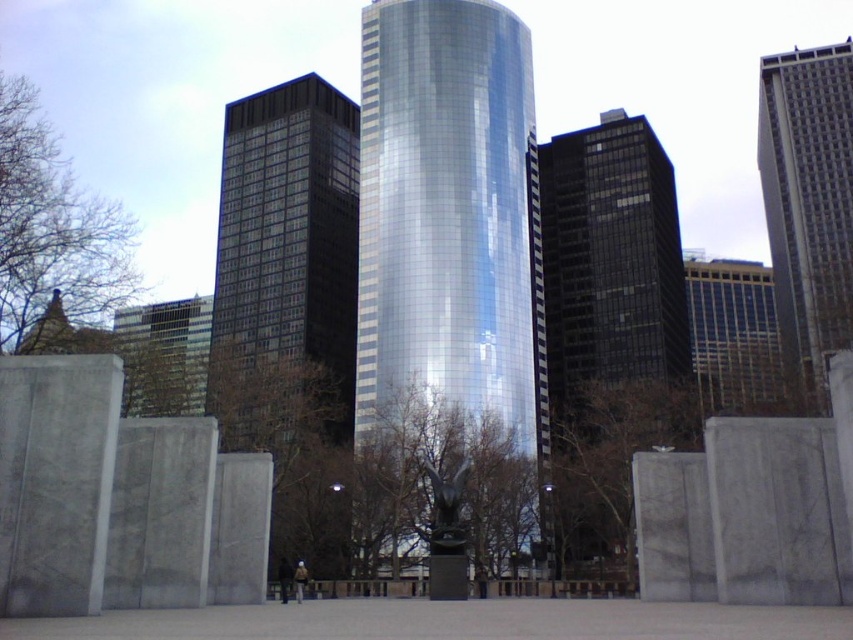
You are standing in the urban landscape and want to move from point A to point B. Point A is located at coordinates point (263, 204) and point B is at point (631, 384). Since you can only move towards objects that are closer to you, can you directly move from point A to point B?

Point (263, 204) is further to the viewer than point (631, 384), so you cannot directly move from point A to point B because point B is farther away from you than point A.

You are a drone operator who needs to fly a drone between the glossy glass skyscraper at center and the gray concrete skyscraper at right. The drone has a maximum flight distance of 100 feet. Can the drone safely fly between them without exceeding its range?

The distance between the glossy glass skyscraper at center and the gray concrete skyscraper at right is 85.98 feet, which is within the drone operator s 100 feet maximum flight distance. Therefore, the drone can safely fly between them without exceeding its range.

You are an architect reviewing the urban layout of the city. You notice the black glass building at center and the glossy glass skyscraper at center. Which one is positioned higher in the image?

The black glass building at center is positioned higher in the image than the glossy glass skyscraper at center.